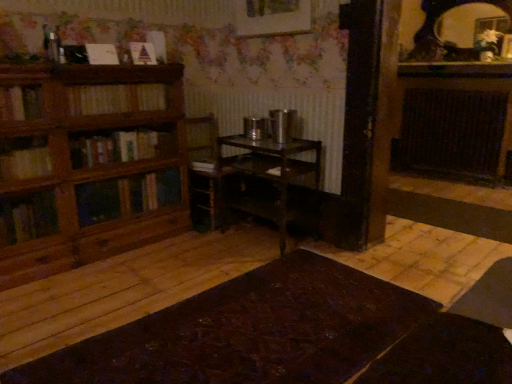
What do you see at coordinates (142, 53) in the screenshot?
I see `matte paper book at upper left, which ranks as the 3th book in bottom-to-top order` at bounding box center [142, 53].

Find the location of a particular element. The width and height of the screenshot is (512, 384). dark brown wooden radiator at right is located at coordinates (455, 134).

Measure the distance between dark brown wooden radiator at right and camera.

dark brown wooden radiator at right is 4.60 meters away from camera.

What do you see at coordinates (115, 98) in the screenshot? I see `wooden bookshelf at left, the 1th book ordered from the bottom` at bounding box center [115, 98].

The height and width of the screenshot is (384, 512). I want to click on wooden bookshelf at left, which appears as the third book when viewed from the top, so click(x=115, y=98).

What do you see at coordinates (88, 164) in the screenshot? The height and width of the screenshot is (384, 512). I see `wooden bookshelf at left` at bounding box center [88, 164].

Measure the distance between point [112,49] and camera.

Point [112,49] is 2.77 meters away from camera.

The height and width of the screenshot is (384, 512). I want to click on metallic dark brown table at center, the second table positioned from the bottom, so click(270, 172).

Which object is wider, metallic dark brown table at center, placed as the 1th table when sorted from top to bottom, or matte paper book at upper left, which ranks as the 3th book in bottom-to-top order?

Wider between the two is metallic dark brown table at center, placed as the 1th table when sorted from top to bottom.

Is metallic dark brown table at center, the second table positioned from the bottom, oriented away from matte paper book at upper left, which ranks as the 3th book in bottom-to-top order?

metallic dark brown table at center, the second table positioned from the bottom, is not turned away from matte paper book at upper left, which ranks as the 3th book in bottom-to-top order.

Is metallic dark brown table at center, the second table positioned from the bottom, at the right side of matte paper book at upper left, which ranks as the 3th book in bottom-to-top order?

Indeed, metallic dark brown table at center, the second table positioned from the bottom, is positioned on the right side of matte paper book at upper left, which ranks as the 3th book in bottom-to-top order.

Which object is wider, metallic dark brown table at center, the second table positioned from the bottom, or wooden bookshelf at left?

With larger width is metallic dark brown table at center, the second table positioned from the bottom.

Between metallic dark brown table at center, placed as the 1th table when sorted from top to bottom, and wooden bookshelf at left, which one is positioned behind?

metallic dark brown table at center, placed as the 1th table when sorted from top to bottom, is further from the camera.

Is metallic dark brown table at center, placed as the 1th table when sorted from top to bottom, to the right of wooden bookshelf at left from the viewer's perspective?

Correct, you'll find metallic dark brown table at center, placed as the 1th table when sorted from top to bottom, to the right of wooden bookshelf at left.

From a real-world perspective, which is physically below, matte black mirror at upper right or metallic dark brown table at center, the second table positioned from the bottom?

In real-world perspective, metallic dark brown table at center, the second table positioned from the bottom, is lower.

Considering the sizes of objects matte black mirror at upper right and metallic dark brown table at center, placed as the 1th table when sorted from top to bottom, in the image provided, who is thinner, matte black mirror at upper right or metallic dark brown table at center, placed as the 1th table when sorted from top to bottom,?

With smaller width is matte black mirror at upper right.

Who is smaller, matte black mirror at upper right or metallic dark brown table at center, placed as the 1th table when sorted from top to bottom?

Smaller between the two is matte black mirror at upper right.

How many degrees apart are the facing directions of matte black mirror at upper right and metallic dark brown table at center, placed as the 1th table when sorted from top to bottom?

The angle between the facing direction of matte black mirror at upper right and the facing direction of metallic dark brown table at center, placed as the 1th table when sorted from top to bottom, is 2.18 degrees.

Is matte paper book at upper left, placed as the first book when sorted from top to bottom, far away from wooden bookshelf at left?

No, there isn't a large distance between matte paper book at upper left, placed as the first book when sorted from top to bottom, and wooden bookshelf at left.

Could you tell me if matte paper book at upper left, which ranks as the 3th book in bottom-to-top order, is turned towards wooden bookshelf at left?

No, matte paper book at upper left, which ranks as the 3th book in bottom-to-top order, is not aimed at wooden bookshelf at left.

Considering the sizes of matte paper book at upper left, placed as the first book when sorted from top to bottom, and wooden bookshelf at left in the image, is matte paper book at upper left, placed as the first book when sorted from top to bottom, taller or shorter than wooden bookshelf at left?

matte paper book at upper left, placed as the first book when sorted from top to bottom, is shorter than wooden bookshelf at left.

Between matte paper book at upper left, which ranks as the 3th book in bottom-to-top order, and wooden bookshelf at left, which one is positioned behind?

Positioned behind is matte paper book at upper left, which ranks as the 3th book in bottom-to-top order.

Locate an element on the screen. radiator behind the dark brown wooden table at center, positioned as the first table in bottom-to-top order is located at coordinates (455, 134).

Considering the relative positions of dark brown wooden table at center, positioned as the first table in bottom-to-top order, and dark brown wooden radiator at right in the image provided, is dark brown wooden table at center, positioned as the first table in bottom-to-top order, behind dark brown wooden radiator at right?

No, dark brown wooden table at center, positioned as the first table in bottom-to-top order, is closer to the viewer.

Considering the sizes of objects dark brown wooden table at center, positioned as the first table in bottom-to-top order, and dark brown wooden radiator at right in the image provided, who is taller, dark brown wooden table at center, positioned as the first table in bottom-to-top order, or dark brown wooden radiator at right?

dark brown wooden radiator at right.

Consider the image. How far apart are dark brown wooden table at center, positioned as the first table in bottom-to-top order, and dark brown wooden radiator at right?

dark brown wooden table at center, positioned as the first table in bottom-to-top order, is 3.48 meters from dark brown wooden radiator at right.

In the scene shown: Which of these two, metallic dark brown table at center, placed as the 1th table when sorted from top to bottom, or dark brown wooden radiator at right, is smaller?

Smaller between the two is metallic dark brown table at center, placed as the 1th table when sorted from top to bottom.

From the image's perspective, who appears lower, metallic dark brown table at center, the second table positioned from the bottom, or dark brown wooden radiator at right?

metallic dark brown table at center, the second table positioned from the bottom, appears lower in the image.

Is metallic dark brown table at center, placed as the 1th table when sorted from top to bottom, not close to dark brown wooden radiator at right?

metallic dark brown table at center, placed as the 1th table when sorted from top to bottom, is far away from dark brown wooden radiator at right.

Considering the relative sizes of metallic dark brown table at center, placed as the 1th table when sorted from top to bottom, and dark brown wooden radiator at right in the image provided, is metallic dark brown table at center, placed as the 1th table when sorted from top to bottom, taller than dark brown wooden radiator at right?

No, metallic dark brown table at center, placed as the 1th table when sorted from top to bottom, is not taller than dark brown wooden radiator at right.

Could you tell me if metallic dark brown table at center, the second table positioned from the bottom, is turned towards wooden bookshelf at left, the 1th book ordered from the bottom?

No, metallic dark brown table at center, the second table positioned from the bottom, is not facing towards wooden bookshelf at left, the 1th book ordered from the bottom.

Is metallic dark brown table at center, placed as the 1th table when sorted from top to bottom, in front of or behind wooden bookshelf at left, the 1th book ordered from the bottom, in the image?

metallic dark brown table at center, placed as the 1th table when sorted from top to bottom, is behind wooden bookshelf at left, the 1th book ordered from the bottom.

From the picture: How distant is metallic dark brown table at center, the second table positioned from the bottom, from wooden bookshelf at left, the 1th book ordered from the bottom?

metallic dark brown table at center, the second table positioned from the bottom, is 31.82 inches from wooden bookshelf at left, the 1th book ordered from the bottom.

Which table is the 2nd one when counting from the right side of the matte paper book at upper left, which ranks as the 3th book in bottom-to-top order? Please provide its 2D coordinates.

[(270, 172)]

Locate an element on the screen. table that appears behind the wooden bookshelf at left is located at coordinates pyautogui.click(x=270, y=172).

Considering their positions, is wooden bookshelf at left positioned further to dark brown wooden radiator at right than wooden picture frame at upper center?

wooden bookshelf at left.

Which object lies further to the anchor point wooden bookshelf at left, the 1th book ordered from the bottom, dark brown wooden radiator at right or matte paper book at upper left, which ranks as the 3th book in bottom-to-top order?

Based on the image, dark brown wooden radiator at right appears to be further to wooden bookshelf at left, the 1th book ordered from the bottom.

Considering their positions, is matte black mirror at upper right positioned further to matte paper book at upper left, placed as the first book when sorted from top to bottom, than dark brown wooden radiator at right?

dark brown wooden radiator at right is further to matte paper book at upper left, placed as the first book when sorted from top to bottom.

When comparing their distances from white paper at upper left, which is the 2th book in top-to-bottom order, does dark brown wooden table at center, positioned as the first table in bottom-to-top order, or metallic dark brown table at center, placed as the 1th table when sorted from top to bottom, seem closer?

The object closer to white paper at upper left, which is the 2th book in top-to-bottom order, is metallic dark brown table at center, placed as the 1th table when sorted from top to bottom.

Considering their positions, is wooden bookshelf at left, the 1th book ordered from the bottom, positioned closer to wooden picture frame at upper center than dark brown wooden radiator at right?

wooden bookshelf at left, the 1th book ordered from the bottom, is positioned closer to the anchor wooden picture frame at upper center.

Considering their positions, is dark brown wooden radiator at right positioned further to white paper at upper left, which is the 2th book in top-to-bottom order, than wooden bookshelf at left?

dark brown wooden radiator at right.

Based on the photo, looking at the image, which one is located closer to wooden bookshelf at left, which appears as the third book when viewed from the top, matte paper book at upper left, which ranks as the 3th book in bottom-to-top order, or white paper at upper left, which is the 2th book in top-to-bottom order?

Among the two, white paper at upper left, which is the 2th book in top-to-bottom order, is located nearer to wooden bookshelf at left, which appears as the third book when viewed from the top.

Looking at this image, considering their positions, is dark brown wooden radiator at right positioned further to wooden bookshelf at left, which appears as the third book when viewed from the top, than dark brown wooden table at center, placed as the second table when sorted from top to bottom?

dark brown wooden radiator at right lies further to wooden bookshelf at left, which appears as the third book when viewed from the top, than the other object.

Image resolution: width=512 pixels, height=384 pixels. What are the coordinates of `picture frame located between matte paper book at upper left, which ranks as the 3th book in bottom-to-top order, and matte black mirror at upper right in the left-right direction` in the screenshot? It's located at (272, 17).

You are a GUI agent. You are given a task and a screenshot of the screen. Output one action in this format:
    pyautogui.click(x=<x>, y=<y>)
    Task: Click on the mirror situated between wooden picture frame at upper center and dark brown wooden radiator at right from left to right
    
    Given the screenshot: What is the action you would take?
    pyautogui.click(x=454, y=8)

This screenshot has width=512, height=384. In order to click on mirror located between wooden bookshelf at left and dark brown wooden radiator at right in the left-right direction in this screenshot , I will do `click(454, 8)`.

Find the location of a particular element. mirror between white paper at upper left, which is the 2th book in top-to-bottom order, and dark brown wooden radiator at right is located at coordinates (454, 8).